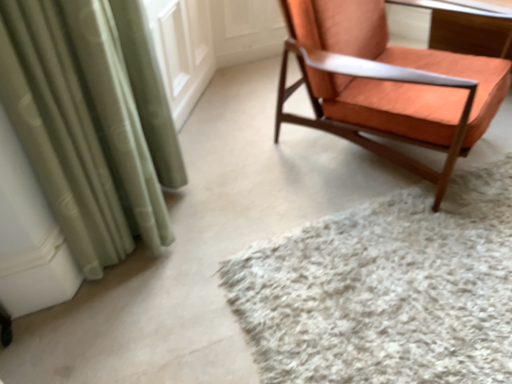
You are a GUI agent. You are given a task and a screenshot of the screen. Output one action in this format:
    pyautogui.click(x=<x>, y=<y>)
    Task: Click on the white shaggy rug at center
    
    Given the screenshot: What is the action you would take?
    pyautogui.click(x=386, y=289)

Is orange fabric chair at upper right inside the boundaries of white shaggy rug at center, or outside?

orange fabric chair at upper right exists outside the volume of white shaggy rug at center.

Is orange fabric chair at upper right not near white shaggy rug at center?

orange fabric chair at upper right is near white shaggy rug at center, not far away.

How much distance is there between orange fabric chair at upper right and white shaggy rug at center?

A distance of 21.47 inches exists between orange fabric chair at upper right and white shaggy rug at center.

Does orange fabric chair at upper right appear on the right side of white shaggy rug at center?

Incorrect, orange fabric chair at upper right is not on the right side of white shaggy rug at center.

Is wooden table at upper right at the back of orange fabric chair at upper right?

Result: orange fabric chair at upper right is not turned away from wooden table at upper right.

Is orange fabric chair at upper right not within wooden table at upper right?

Yes, orange fabric chair at upper right is located beyond the bounds of wooden table at upper right.

Can you confirm if orange fabric chair at upper right is bigger than wooden table at upper right?

Yes.

From a real-world perspective, relative to wooden table at upper right, is orange fabric chair at upper right vertically above or below?

orange fabric chair at upper right is above wooden table at upper right.

From the image's perspective, which is below, wooden table at upper right or white shaggy rug at center?

From the image's view, white shaggy rug at center is below.

Does point (466, 33) come in front of point (396, 296)?

No.

Is there a large distance between wooden table at upper right and white shaggy rug at center?

Yes, wooden table at upper right and white shaggy rug at center are located far from each other.

From a real-world perspective, is white shaggy rug at center beneath wooden table at upper right?

Yes.

Which of these two, white shaggy rug at center or wooden table at upper right, is wider?

white shaggy rug at center is wider.

Find the location of a particular element. mat that is below the wooden table at upper right (from the image's perspective) is located at coordinates (386, 289).

Which object is closer to the camera taking this photo, wooden table at upper right or orange fabric chair at upper right?

orange fabric chair at upper right.

Is point (493, 45) behind point (405, 118)?

Yes, point (493, 45) is farther from viewer.

Who is shorter, wooden table at upper right or orange fabric chair at upper right?

Standing shorter between the two is wooden table at upper right.

Can you confirm if wooden table at upper right is thinner than orange fabric chair at upper right?

Correct, the width of wooden table at upper right is less than that of orange fabric chair at upper right.

Is point (446, 342) positioned after point (509, 67)?

That is False.

Is white shaggy rug at center inside or outside of orange fabric chair at upper right?

white shaggy rug at center is not enclosed by orange fabric chair at upper right.

From the picture: Is the position of white shaggy rug at center more distant than that of orange fabric chair at upper right?

No.

Identify the location of mat below the orange fabric chair at upper right (from the image's perspective). (386, 289).

Identify the location of chair that is above the wooden table at upper right (from a real-world perspective). (387, 85).

When comparing their distances from orange fabric chair at upper right, does white shaggy rug at center or wooden table at upper right seem further?

Based on the image, wooden table at upper right appears to be further to orange fabric chair at upper right.

From the image, which object appears to be farther from white shaggy rug at center, orange fabric chair at upper right or wooden table at upper right?

wooden table at upper right is further to white shaggy rug at center.

From the image, which object appears to be farther from orange fabric chair at upper right, wooden table at upper right or white shaggy rug at center?

The object further to orange fabric chair at upper right is wooden table at upper right.

Which object lies nearer to the anchor point white shaggy rug at center, wooden table at upper right or orange fabric chair at upper right?

The object closer to white shaggy rug at center is orange fabric chair at upper right.

Estimate the real-world distances between objects in this image. Which object is further from wooden table at upper right, orange fabric chair at upper right or white shaggy rug at center?

white shaggy rug at center is positioned further to the anchor wooden table at upper right.

Looking at the image, which one is located further to wooden table at upper right, white shaggy rug at center or orange fabric chair at upper right?

white shaggy rug at center lies further to wooden table at upper right than the other object.

Image resolution: width=512 pixels, height=384 pixels. I want to click on chair between wooden table at upper right and white shaggy rug at center in the up-down direction, so click(x=387, y=85).